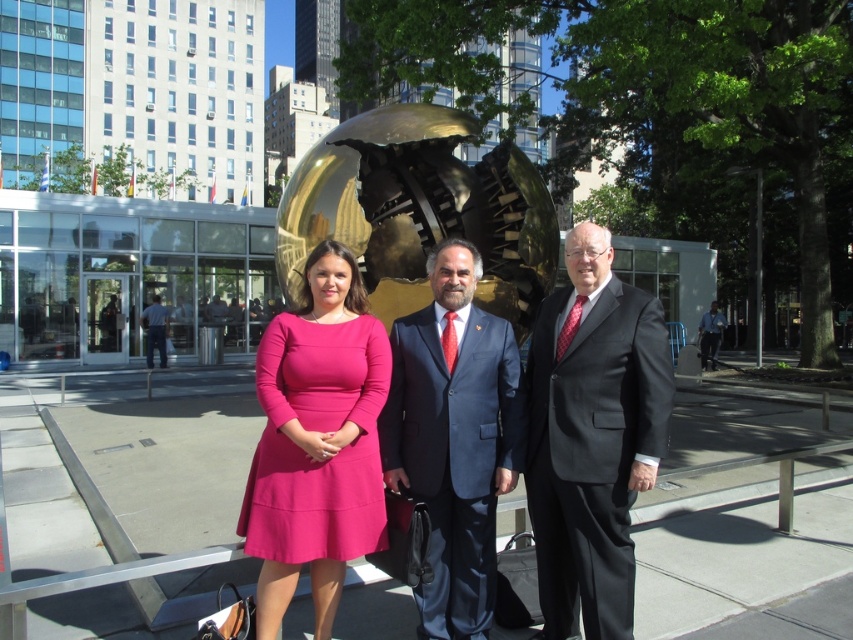
You are a photographer trying to capture a photo of the gold polished sphere at center and the matte pink dress at center. Based on their positions, which object should you adjust your camera to focus on first if you want to capture both in the same frame without moving the camera?

The gold polished sphere at center is to the left of the matte pink dress at center, so you should focus on the gold polished sphere at center first as it is closer to the left side of the frame, allowing both objects to be captured in the same shot without moving the camera.

In the scene shown: You are a photographer trying to capture a closeup of the matte black suit at center. The camera you are using has a focal length of 50mm and a sensor size of 24mm x 36mm. Given that the point at coordinates (592, 436) is where the matte black suit is located, what is the minimum distance you need to be from the subject to ensure the entire suit fits within the frame?

To determine the minimum distance, use the formula for field of view. The vertical FOV is 2 arctan. The point at (592, 436) indicates the center, so the distance must accommodate the sensor dimensions and focal length. However, without knowing the subject size, precise calculation isn